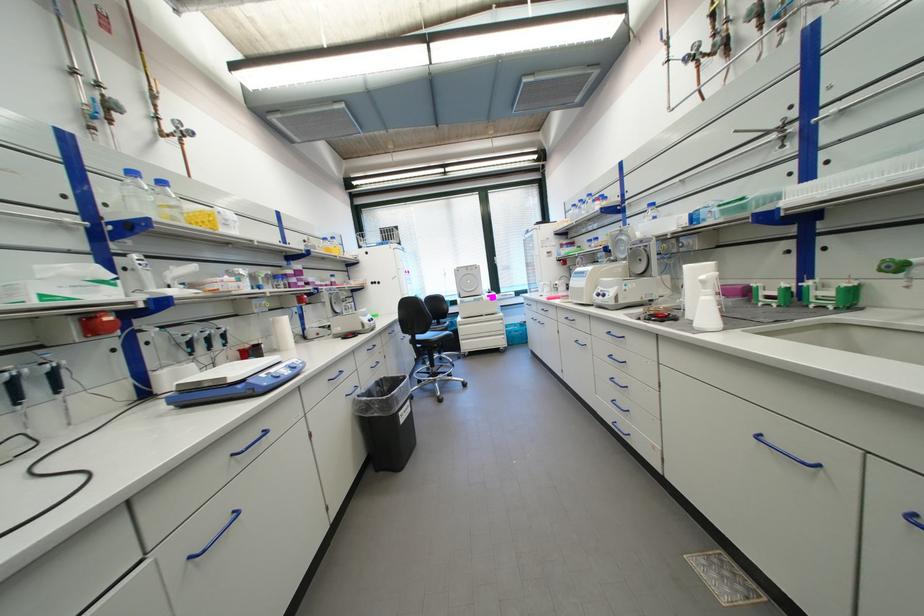
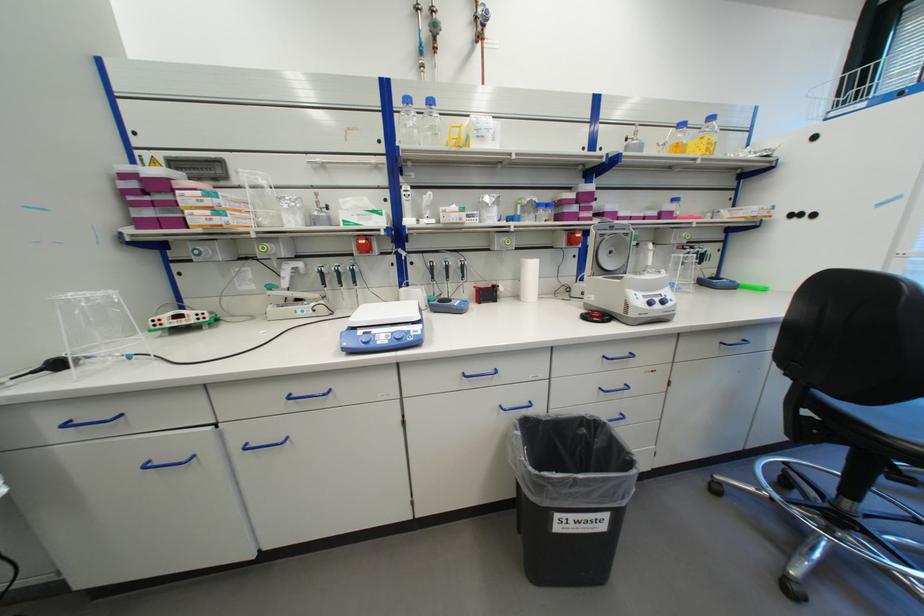
In the second image, find the point that corresponds to pixel 346 312 in the first image.

(616, 267)